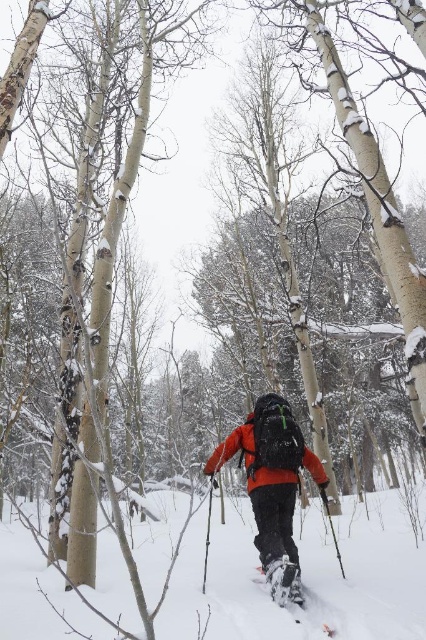
In the scene shown: You are a hiker in the snowy forest and see the white textured snowshoe at center and the black textured ski pole at center. Which object is positioned to the left?

The white textured snowshoe at center is positioned to the left of the black textured ski pole at center.

You are navigating a snowy forest and see a person wearing an orange fleece jacket at center. If you want to approach them, in which direction should you move relative to your current position?

The orange fleece jacket at center is located at point (x=268, y=445), so you should move towards the coordinates (x=268, y=445) to reach them.

You are a photographer trying to capture the person in the matte orange jacket at center while standing on the white fluffy snow at center. Will the snow cover the entire jacket in your photo?

The white fluffy snow at center is taller than the matte orange jacket at center, so the snow will cover the entire jacket in your photo.